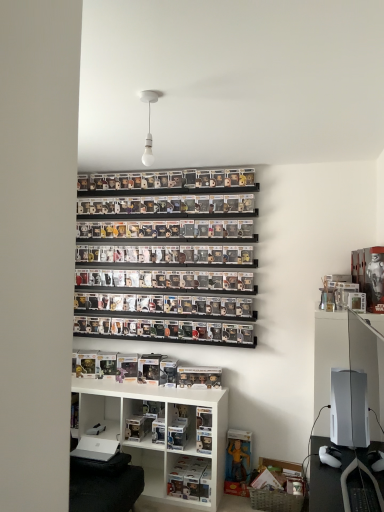
Question: Choose the correct answer: Is white matte gaming console at right inside clear plastic figure at lower center, which is counted as the third shelf, starting from the top, or outside it?

Choices:
 (A) inside
 (B) outside

Answer: (B)

Question: Is white matte gaming console at right taller or shorter than clear plastic figure at lower center, which is counted as the third shelf, starting from the top?

Choices:
 (A) tall
 (B) short

Answer: (A)

Question: Which is nearer to the clear plastic figures at center, placed as the 3th shelf when sorted from bottom to top?

Choices:
 (A) white matte gaming console at right
 (B) white plastic shelf at lower center, acting as the 2th shelf starting from the bottom
 (C) white matte bulb at upper center
 (D) clear plastic figure at lower center, the first shelf ordered from the bottom

Answer: (B)

Question: Which object is the farthest from the white plastic shelf at lower center, which is the second shelf from top to bottom?

Choices:
 (A) white matte bulb at upper center
 (B) clear plastic figure at lower center, which is counted as the third shelf, starting from the top
 (C) clear plastic figures at center, placed as the 3th shelf when sorted from bottom to top
 (D) white matte gaming console at right

Answer: (A)